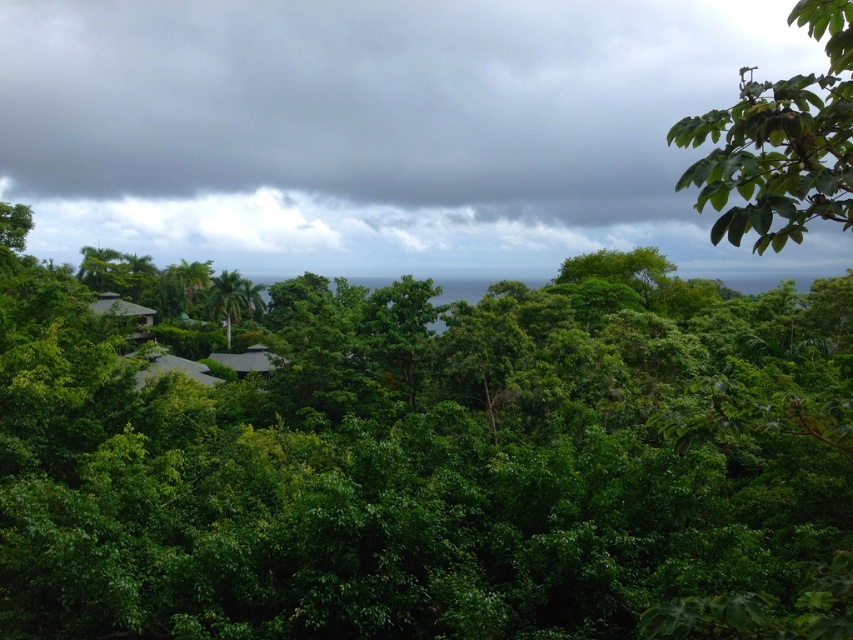
You are standing in a lush forest and want to reach a specific location marked by the point at coordinates point (643, 48). If you can walk 100 meters per hour, how many hours will it take you to reach that point?

The point at coordinates point (643, 48) is 251.96 meters away from you. At a walking speed of 100 meters per hour, it will take approximately 2.52 hours to reach that point.